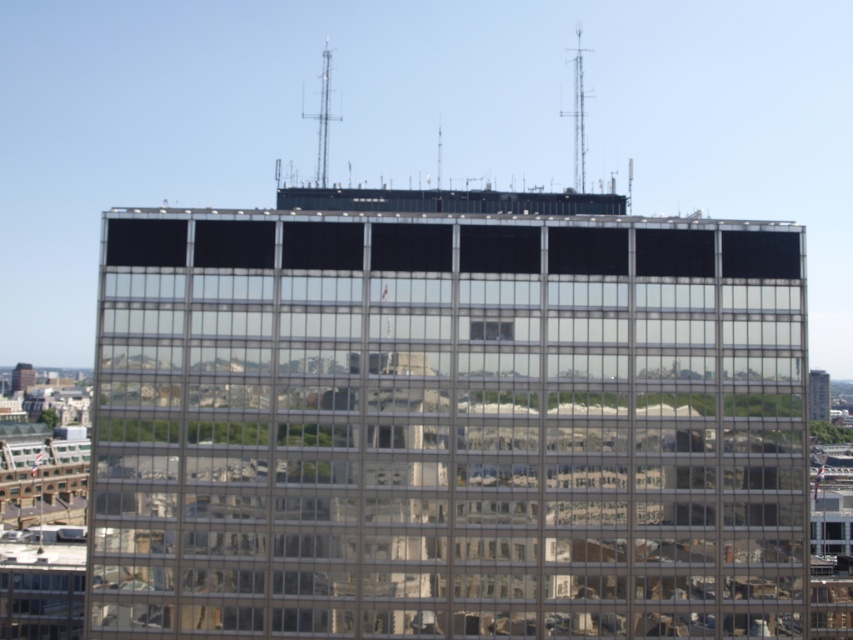
Question: Is glassy reflective tower at right bigger than matte glass tower at lower left?

Choices:
 (A) yes
 (B) no

Answer: (A)

Question: Can you confirm if metallic antenna at top right is thinner than metallic antenna at top center?

Choices:
 (A) yes
 (B) no

Answer: (B)

Question: Does metallic antenna at top right appear on the left side of matte glass tower at lower left?

Choices:
 (A) no
 (B) yes

Answer: (A)

Question: Based on their relative distances, which object is farther from the matte glass tower at lower left?

Choices:
 (A) glassy reflective tower at right
 (B) clear glass windows at center

Answer: (B)

Question: Based on their relative distances, which object is nearer to the metallic antenna at top right?

Choices:
 (A) glassy reflective tower at right
 (B) matte glass tower at lower left

Answer: (A)

Question: Which object is positioned closest to the glassy reflective tower at right?

Choices:
 (A) metallic antenna at top center
 (B) matte glass tower at lower left
 (C) metallic antenna at top right

Answer: (C)